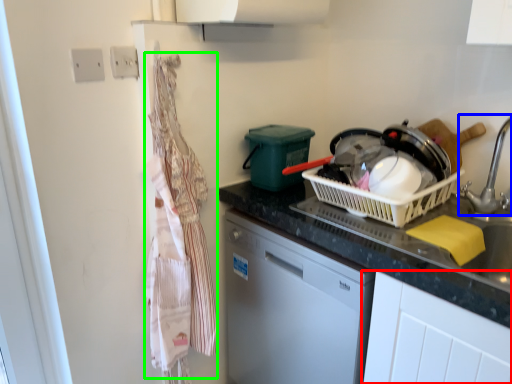
Question: Which is farther away from cabinetry (highlighted by a red box)? faucet (highlighted by a blue box) or laundry (highlighted by a green box)?

Choices:
 (A) faucet
 (B) laundry

Answer: (B)